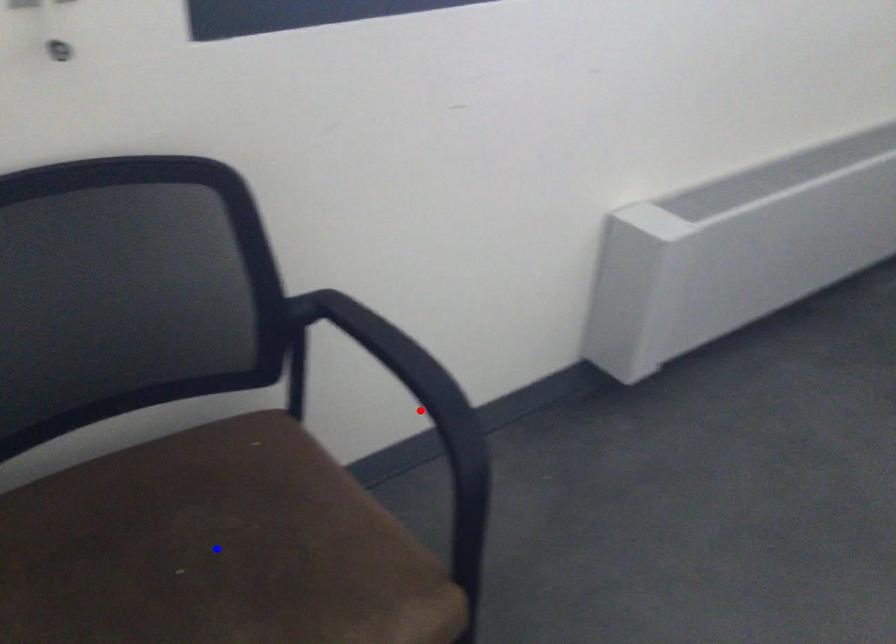
Question: In the image, two points are highlighted. Which point is nearer to the camera? Reply with the corresponding letter.

Choices:
 (A) blue point
 (B) red point

Answer: (B)